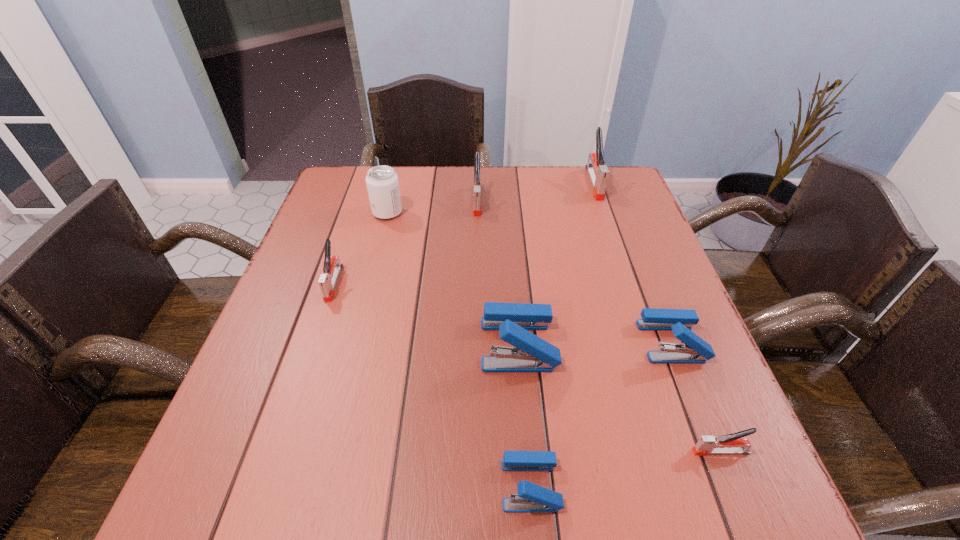
Locate an element on the screen. Image resolution: width=960 pixels, height=540 pixels. the nearest blue stapler is located at coordinates (531, 497).

You are a GUI agent. You are given a task and a screenshot of the screen. Output one action in this format:
    pyautogui.click(x=<x>, y=<y>)
    Task: Click on the nearest stapler
    The height and width of the screenshot is (540, 960).
    Given the screenshot: What is the action you would take?
    pyautogui.click(x=531, y=497)

Where is `vacant space located on the handle side of the tallest stapler`? The width and height of the screenshot is (960, 540). vacant space located on the handle side of the tallest stapler is located at coordinates (605, 215).

I want to click on free space located 0.230m on the handle side of the third gray stapler from right to left, so click(477, 274).

At what (x,y) coordinates should I click in order to perform the action: click on free space located 0.260m on the right of the soda can. Please return your answer as a coordinate pair (x, y). Looking at the image, I should click on (497, 213).

Locate an element on the screen. The image size is (960, 540). vacant space located 0.330m on the left of the biggest blue stapler is located at coordinates point(317,344).

The width and height of the screenshot is (960, 540). In order to click on free spot located 0.360m on the handle side of the leftmost gray stapler in this screenshot , I will do `click(273, 465)`.

Find the location of a particular element. This screenshot has width=960, height=540. vacant area situated on the front of the second biggest blue stapler is located at coordinates (723, 474).

Identify the location of vacant region located on the handle side of the smallest gray stapler. (572, 451).

Find the location of `vacant space located on the handle side of the smallest gray stapler`. vacant space located on the handle side of the smallest gray stapler is located at coordinates (633, 451).